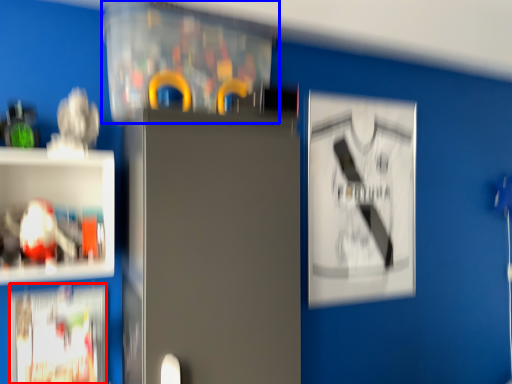
Question: Which of the following is the farthest to the observer, poster (highlighted by a red box) or cabinet (highlighted by a blue box)?

Choices:
 (A) poster
 (B) cabinet

Answer: (A)